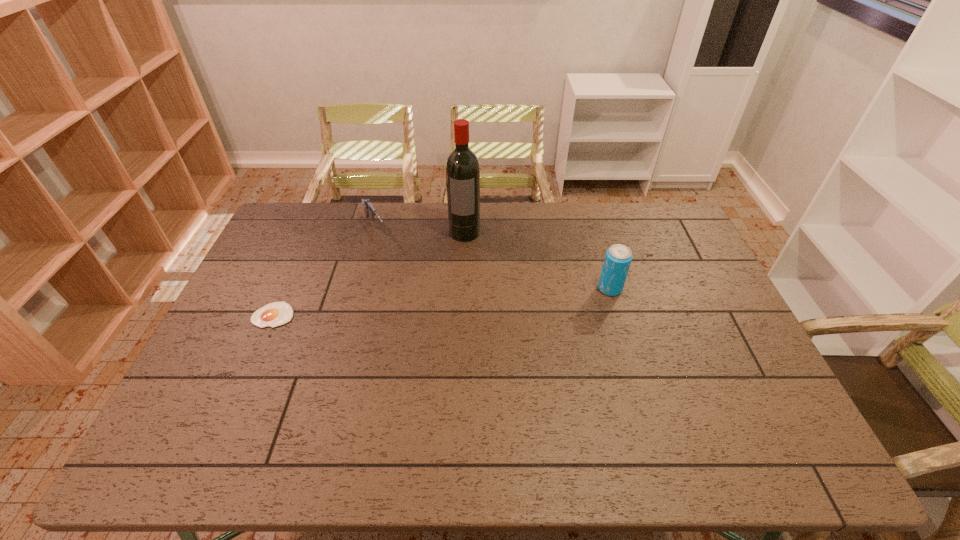
The height and width of the screenshot is (540, 960). Identify the location of free space at the near edge of the desktop. (325, 410).

The width and height of the screenshot is (960, 540). Identify the location of vacant space at the left edge of the desktop. (282, 285).

Locate an element on the screen. The width and height of the screenshot is (960, 540). vacant space at the right edge of the desktop is located at coordinates tap(654, 245).

The height and width of the screenshot is (540, 960). Identify the location of free region at the far left corner. (284, 238).

The image size is (960, 540). I want to click on free region at the near left corner, so 185,420.

You are a GUI agent. You are given a task and a screenshot of the screen. Output one action in this format:
    pyautogui.click(x=<x>, y=<y>)
    Task: Click on the free space between the nearest object and the rightmost object
    The width and height of the screenshot is (960, 540).
    Given the screenshot: What is the action you would take?
    pyautogui.click(x=442, y=302)

The image size is (960, 540). I want to click on vacant area that lies between the soda can and the shortest object, so click(442, 302).

The image size is (960, 540). In order to click on free point between the rightmost object and the second object from left to right in this screenshot , I will do `click(492, 259)`.

Where is `vacant area that lies between the second object from left to right and the egg yolk`? This screenshot has width=960, height=540. vacant area that lies between the second object from left to right and the egg yolk is located at coordinates (324, 272).

Locate an element on the screen. The image size is (960, 540). free spot between the third object from right to left and the soda can is located at coordinates (492, 259).